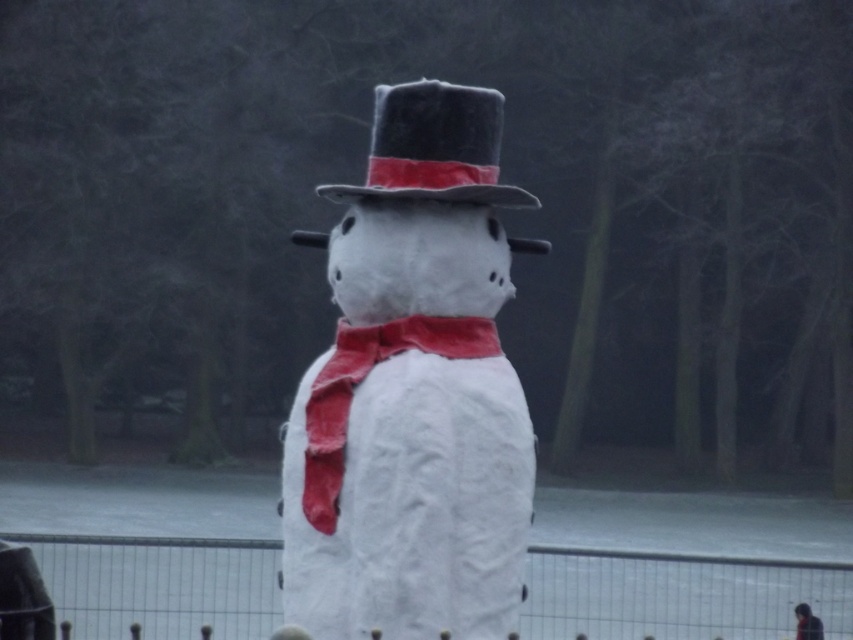
Question: Which point appears closest to the camera in this image?

Choices:
 (A) (339, 388)
 (B) (805, 637)
 (C) (444, 97)
 (D) (469, 148)

Answer: (A)

Question: Does felt/black dress hat at center appear over dark gray fabric coat at lower right?

Choices:
 (A) yes
 (B) no

Answer: (A)

Question: Based on their relative distances, which object is farther from the dark gray fabric coat at lower right?

Choices:
 (A) red fabric bow tie at center
 (B) white paper snowman at center

Answer: (A)

Question: Observing the image, what is the correct spatial positioning of felt/black dress hat at center in reference to red fabric bow tie at center?

Choices:
 (A) above
 (B) below

Answer: (A)

Question: Can you confirm if white paper snowman at center is positioned to the left of dark gray fabric coat at lower right?

Choices:
 (A) yes
 (B) no

Answer: (A)

Question: Which point is farther from the camera taking this photo?

Choices:
 (A) (480, 300)
 (B) (416, 140)
 (C) (809, 618)
 (D) (312, 381)

Answer: (C)